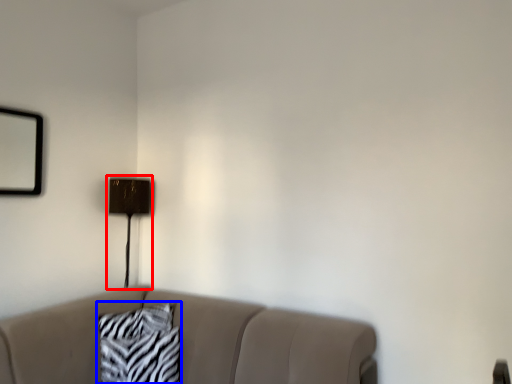
Question: Which object appears farthest to the camera in this image, table lamp (highlighted by a red box) or pillow (highlighted by a blue box)?

Choices:
 (A) table lamp
 (B) pillow

Answer: (A)